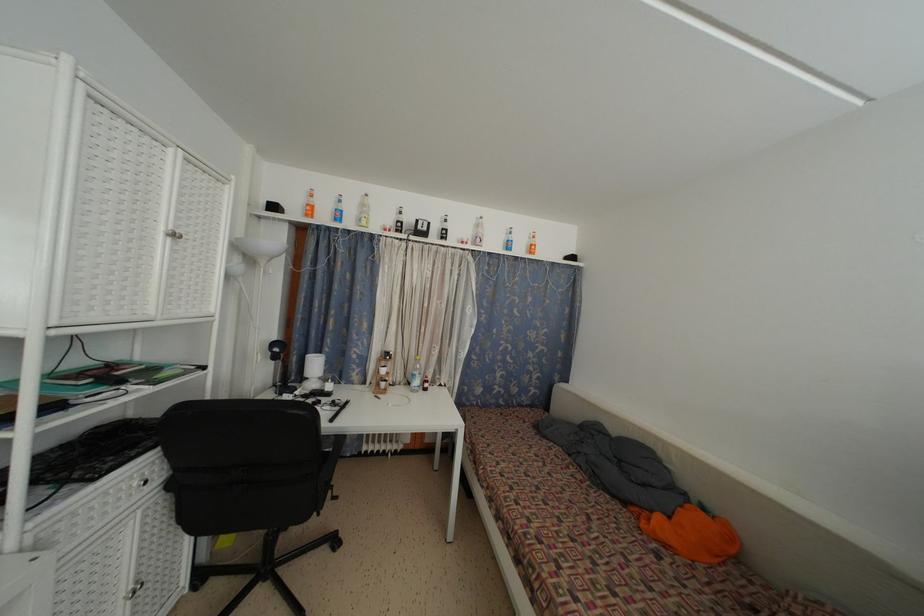
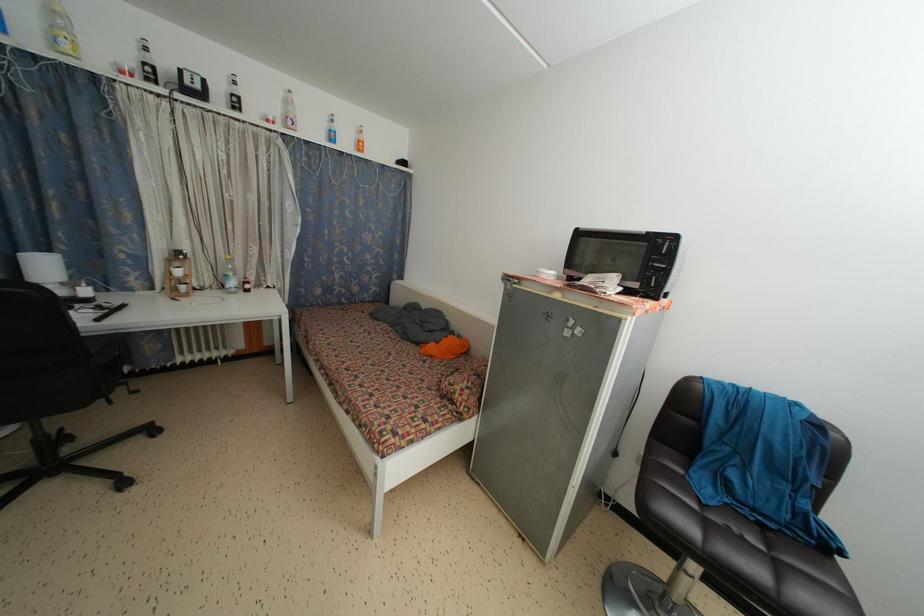
Locate, in the second image, the point that corresponds to (x=348, y=407) in the first image.

(122, 310)